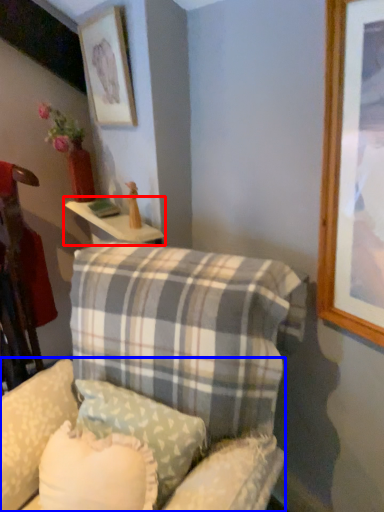
Question: Which object is further to the camera taking this photo, table (highlighted by a red box) or swivel chair (highlighted by a blue box)?

Choices:
 (A) table
 (B) swivel chair

Answer: (A)